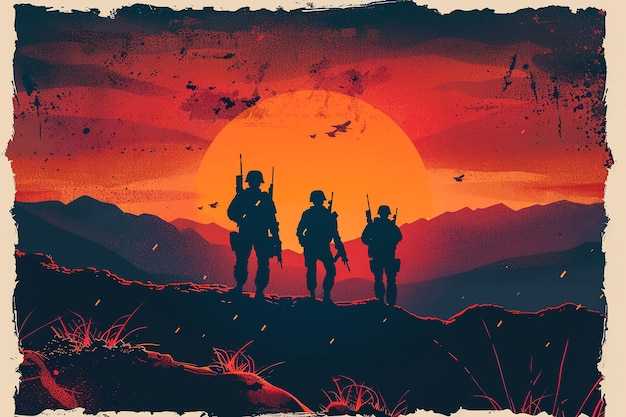
This screenshot has height=417, width=626. Find the location of `picture`. picture is located at coordinates (576, 68).